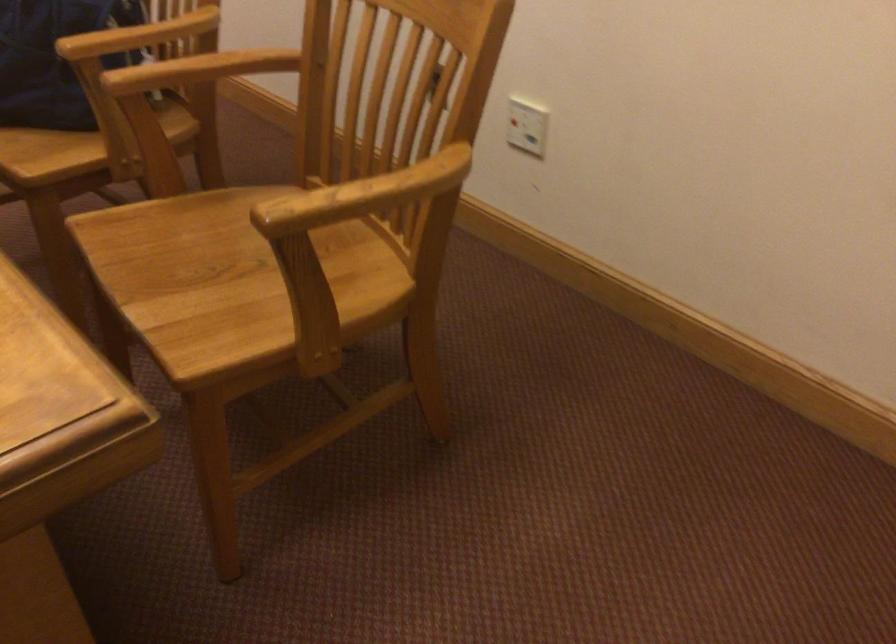
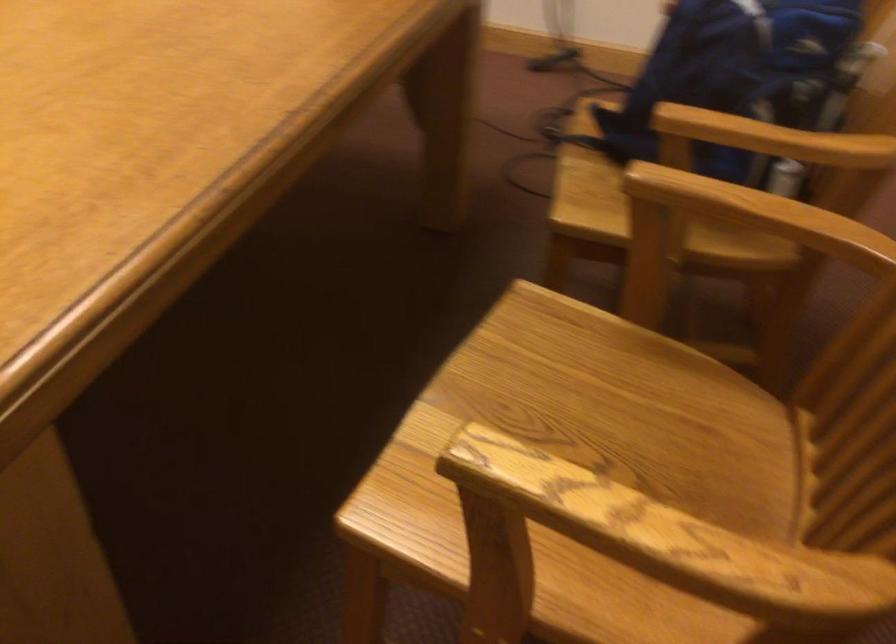
Where in the second image is the point corresponding to pixel 200 232 from the first image?

(595, 386)